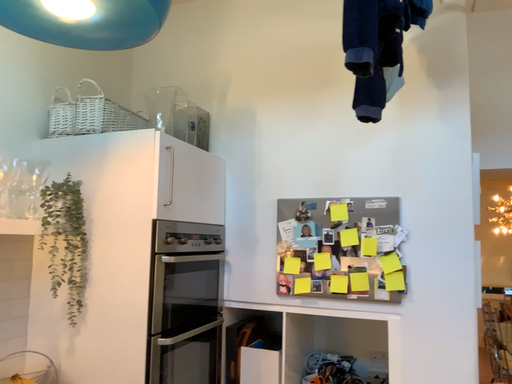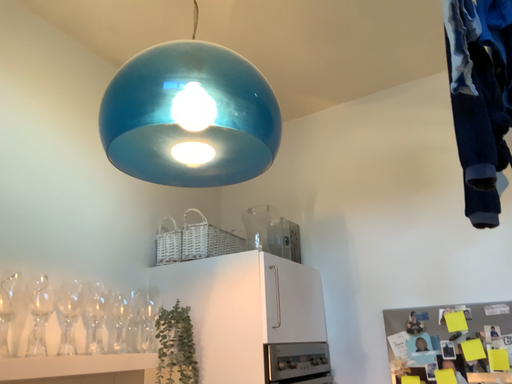
Question: How did the camera likely rotate when shooting the video?

Choices:
 (A) rotated downward
 (B) rotated upward

Answer: (B)